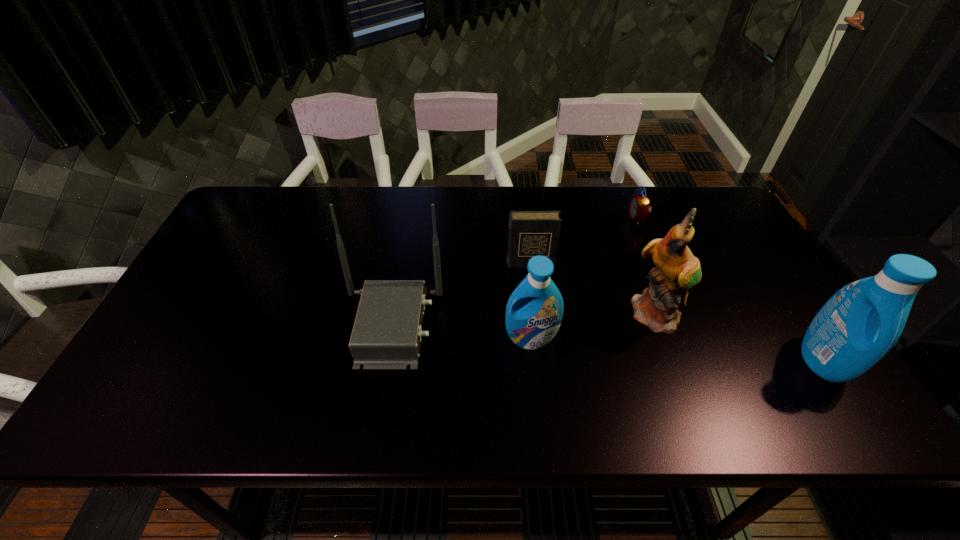
This screenshot has width=960, height=540. I want to click on the fourth tallest object, so click(534, 311).

Identify the location of the left detergent. This screenshot has height=540, width=960. (534, 311).

Identify the location of the taller detergent. The image size is (960, 540). pos(857,327).

This screenshot has height=540, width=960. I want to click on the right detergent, so click(x=857, y=327).

Where is `parrot`? The image size is (960, 540). parrot is located at coordinates (677, 270).

What are the coordinates of `the second farthest object` in the screenshot? It's located at (531, 233).

You are a GUI agent. You are given a task and a screenshot of the screen. Output one action in this format:
    pyautogui.click(x=<x>, y=<y>)
    Task: Click on the diary
    The height and width of the screenshot is (540, 960).
    Given the screenshot: What is the action you would take?
    pyautogui.click(x=531, y=233)

Identify the location of alarm clock. tap(639, 208).

Locate an element on the screen. the farthest object is located at coordinates (639, 208).

At what (x,y) coordinates should I click in order to perform the action: click on the leftmost object. Please return your answer as a coordinate pair (x, y). The image size is (960, 540). Looking at the image, I should click on (387, 331).